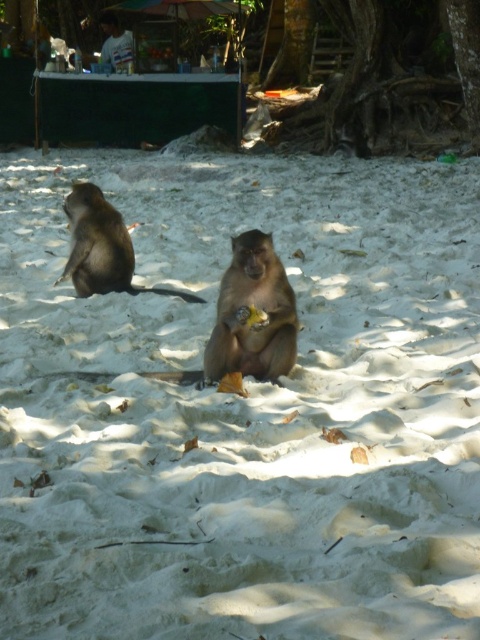
Question: Which point is closer to the camera?

Choices:
 (A) brown furry monkey at left
 (B) brown rough tree roots at lower center

Answer: (A)

Question: Does brown rough tree roots at lower center appear on the right side of brown furry monkey at left?

Choices:
 (A) no
 (B) yes

Answer: (B)

Question: Is brown rough tree roots at lower center smaller than brown furry monkey at center?

Choices:
 (A) yes
 (B) no

Answer: (B)

Question: In this image, where is brown rough tree roots at lower center located relative to brown furry monkey at center?

Choices:
 (A) left
 (B) right

Answer: (B)

Question: Which point is closer to the camera?

Choices:
 (A) brown furry monkey at left
 (B) brown rough tree roots at lower center
 (C) brown furry monkey at center

Answer: (C)

Question: Which object appears farthest from the camera in this image?

Choices:
 (A) brown furry monkey at center
 (B) brown rough tree roots at lower center
 (C) brown furry monkey at left

Answer: (B)